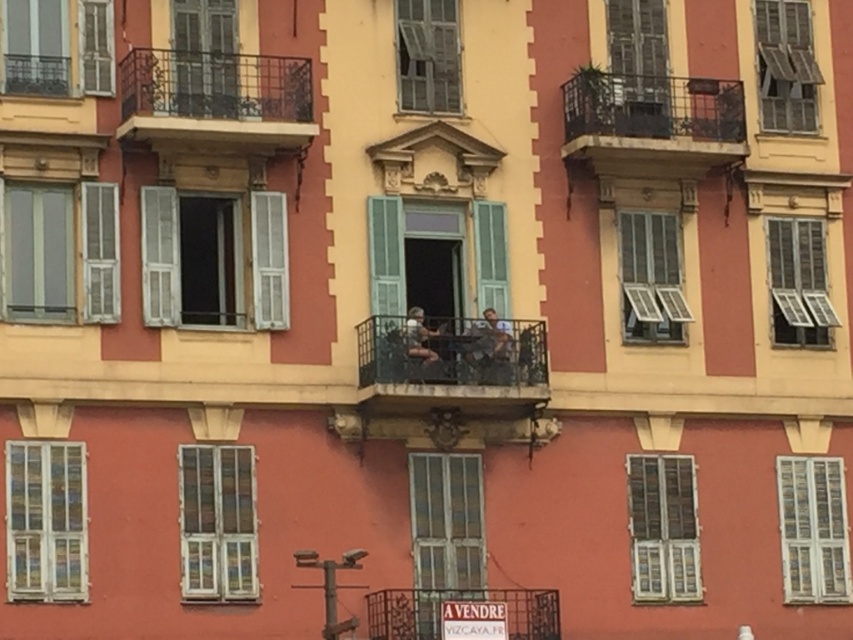
Question: Is white wooden window at lower right positioned in front of wooden window at upper right?

Choices:
 (A) no
 (B) yes

Answer: (B)

Question: Can you confirm if wooden shutters at upper left is positioned below matte black person at center?

Choices:
 (A) yes
 (B) no

Answer: (B)

Question: Is wooden shutters at lower right positioned behind matte gray window at center right?

Choices:
 (A) no
 (B) yes

Answer: (A)

Question: Among these points, which one is farthest from the camera?

Choices:
 (A) (809, 483)
 (B) (659, 525)

Answer: (A)

Question: Among these points, which one is nearest to the camera?

Choices:
 (A) (807, 296)
 (B) (625, 275)

Answer: (B)

Question: Which object is the farthest from the matte gray window at center right?

Choices:
 (A) black wrought iron balcony at center
 (B) wooden window at center

Answer: (B)